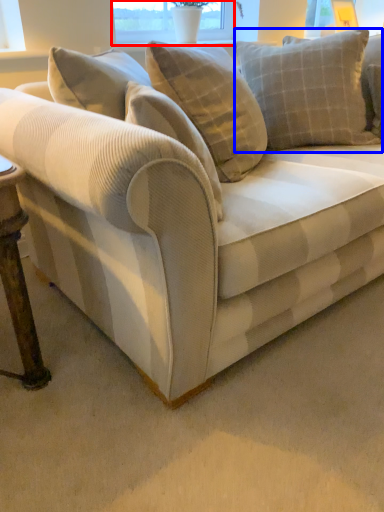
Question: Which of the following is the farthest to the observer, window screen (highlighted by a red box) or pillow (highlighted by a blue box)?

Choices:
 (A) window screen
 (B) pillow

Answer: (A)